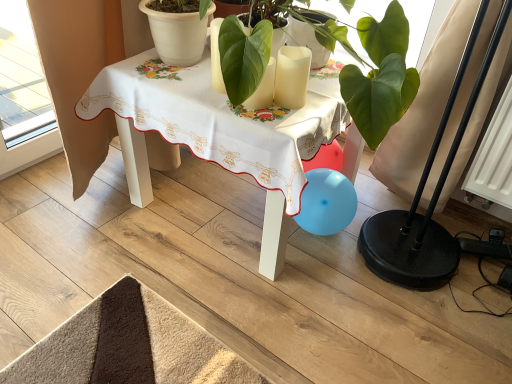
At what (x,y) coordinates should I click in order to perform the action: click on vacant space underneath white matte flowerpot at upper center (from a real-world perspective). Please return your answer as a coordinate pair (x, y). The image size is (512, 384). Looking at the image, I should click on point(173,59).